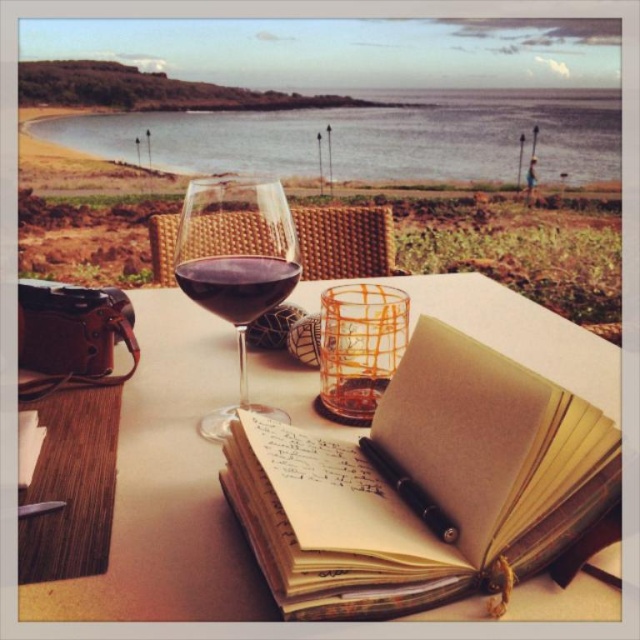
Is beige paper notebook at center thinner than black metallic pen at center?

No.

Who is higher up, beige paper notebook at center or black metallic pen at center?

beige paper notebook at center is higher up.

Locate an element on the screen. beige paper notebook at center is located at coordinates [x=422, y=484].

Between clear water at upper center and translucent glass wine glass at center, which one has more height?

translucent glass wine glass at center is taller.

Does clear water at upper center have a lesser height compared to translucent glass wine glass at center?

Yes.

Between point (384, 125) and point (212, 266), which one is positioned behind?

Point (384, 125)

In order to click on clear water at upper center in this screenshot , I will do `click(372, 138)`.

Does beige paper notebook at center have a lesser width compared to clear water at upper center?

Correct, beige paper notebook at center's width is less than clear water at upper center's.

Where is `beige paper notebook at center`? beige paper notebook at center is located at coordinates (422, 484).